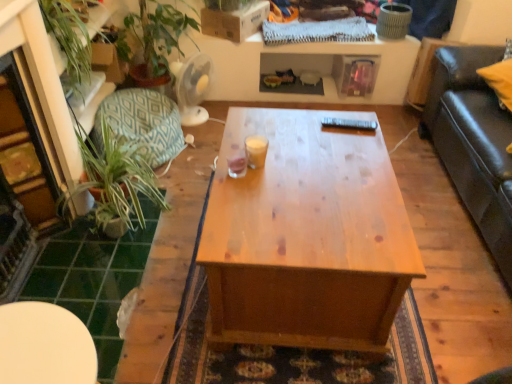
Where is `free space to the right of translucent glass at center, which ranks as the second coffee cup in right-to-left order`? The image size is (512, 384). free space to the right of translucent glass at center, which ranks as the second coffee cup in right-to-left order is located at coordinates (279, 172).